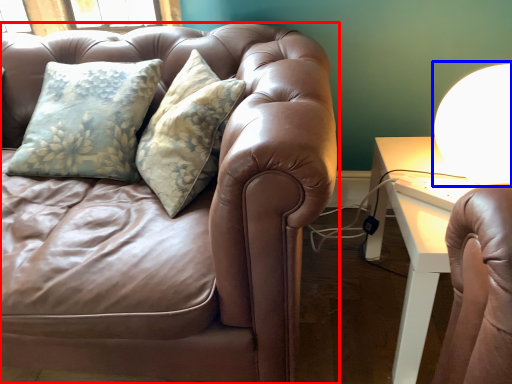
Question: Which object appears closest to the camera in this image, studio couch (highlighted by a red box) or table lamp (highlighted by a blue box)?

Choices:
 (A) studio couch
 (B) table lamp

Answer: (A)